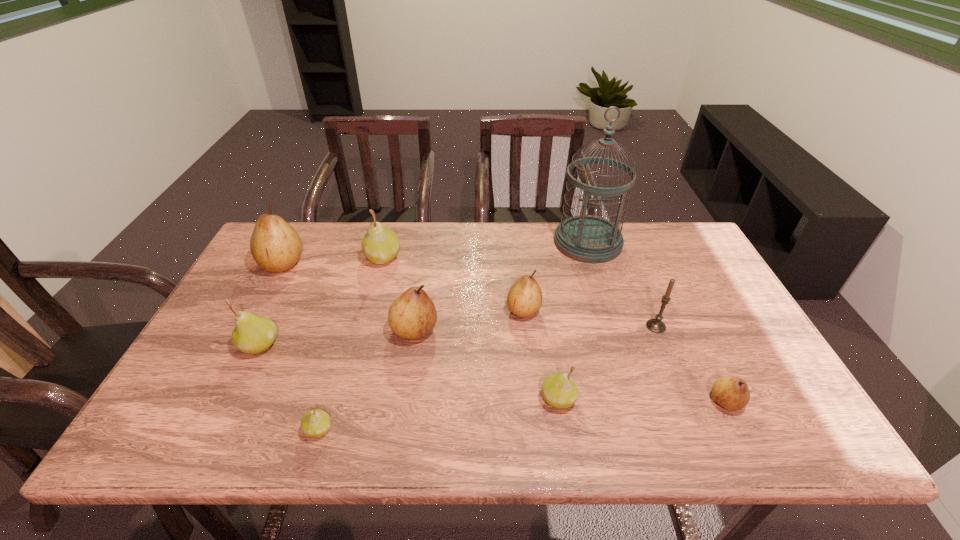
I want to click on free spot between the third biggest brown pear and the birdcage, so click(556, 276).

This screenshot has height=540, width=960. Identify the location of unoccupied area between the third brown pear from left to right and the leftmost brown pear. (403, 287).

You are a GUI agent. You are given a task and a screenshot of the screen. Output one action in this format:
    pyautogui.click(x=<x>, y=<y>)
    Task: Click on the free space between the rightmost brown pear and the third smallest brown pear
    This screenshot has width=960, height=540.
    Given the screenshot: What is the action you would take?
    pyautogui.click(x=570, y=366)

Locate which object is the sixth closest to the second brown pear from right to left. Please provide its 2D coordinates. Your answer should be formatted as a tuple, i.e. [(x, y)], where the tuple contains the x and y coordinates of a point satisfying the conditions above.

[(732, 393)]

In order to click on object that is the sixth closest to the fifth pear from left to right in this screenshot , I will do `click(276, 247)`.

Locate which pear ranks in proximity to the biggest brown pear. Please provide its 2D coordinates. Your answer should be formatted as a tuple, i.e. [(x, y)], where the tuple contains the x and y coordinates of a point satisfying the conditions above.

[(380, 244)]

Locate which pear is the fourth closest to the third smallest green pear. Please provide its 2D coordinates. Your answer should be formatted as a tuple, i.e. [(x, y)], where the tuple contains the x and y coordinates of a point satisfying the conditions above.

[(380, 244)]

Identify which green pear is the third closest to the third biggest brown pear. Please provide its 2D coordinates. Your answer should be formatted as a tuple, i.e. [(x, y)], where the tuple contains the x and y coordinates of a point satisfying the conditions above.

[(315, 423)]

At what (x,y) coordinates should I click in order to perform the action: click on the closest green pear to the farthest brown pear. Please return your answer as a coordinate pair (x, y). Image resolution: width=960 pixels, height=540 pixels. Looking at the image, I should click on (380, 244).

Select which brown pear appears as the closest to the smallest brown pear. Please provide its 2D coordinates. Your answer should be formatted as a tuple, i.e. [(x, y)], where the tuple contains the x and y coordinates of a point satisfying the conditions above.

[(524, 299)]